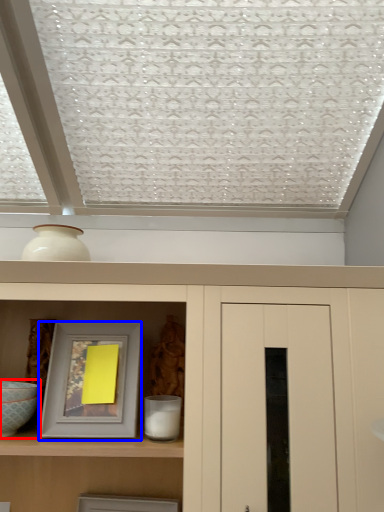
Question: Among these objects, which one is farthest to the camera, glass bowl (highlighted by a red box) or picture frame (highlighted by a blue box)?

Choices:
 (A) glass bowl
 (B) picture frame

Answer: (B)